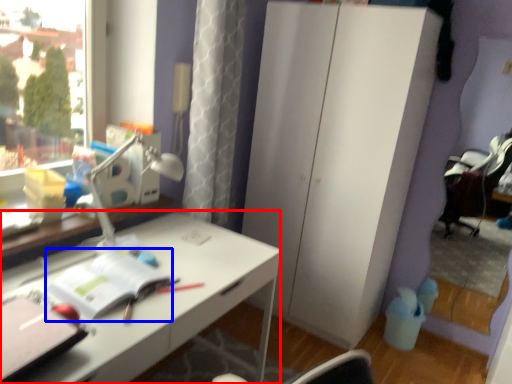
Question: Which point is closer to the camera, desk (highlighted by a red box) or notebook (highlighted by a blue box)?

Choices:
 (A) desk
 (B) notebook

Answer: (A)